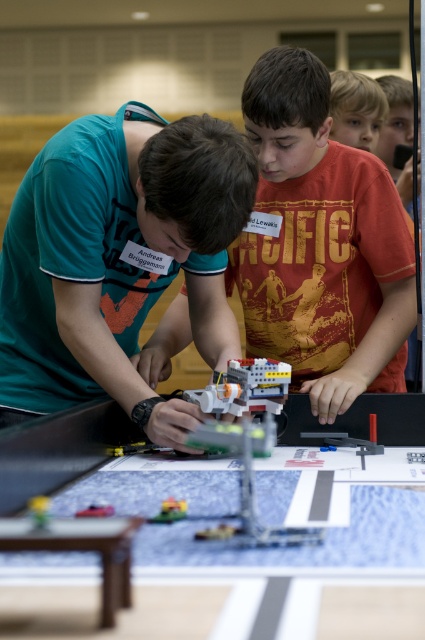
Question: Which point is farther from the camera taking this photo?

Choices:
 (A) (360, 131)
 (B) (159, 518)
 (C) (320, 432)
 (D) (113, 508)

Answer: (A)

Question: Which point is closer to the camera?

Choices:
 (A) (305, 435)
 (B) (170, 188)

Answer: (B)

Question: Which point appears farthest from the camera in this image?

Choices:
 (A) (240, 214)
 (B) (382, 449)

Answer: (B)

Question: From the image, what is the correct spatial relationship of translucent plastic toy at lower left in relation to translucent plastic toy at center?

Choices:
 (A) above
 (B) below

Answer: (A)

Question: Is matte orange shirt at upper right closer to the viewer compared to black plastic toy at center?

Choices:
 (A) yes
 (B) no

Answer: (B)

Question: Is black plastic toy at center smaller than translucent plastic toy car at center?

Choices:
 (A) yes
 (B) no

Answer: (B)